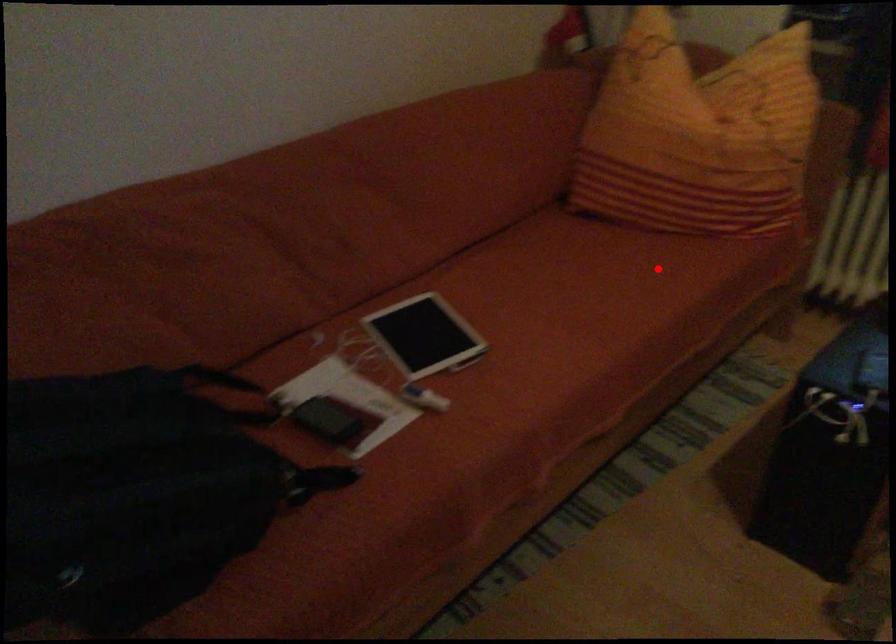
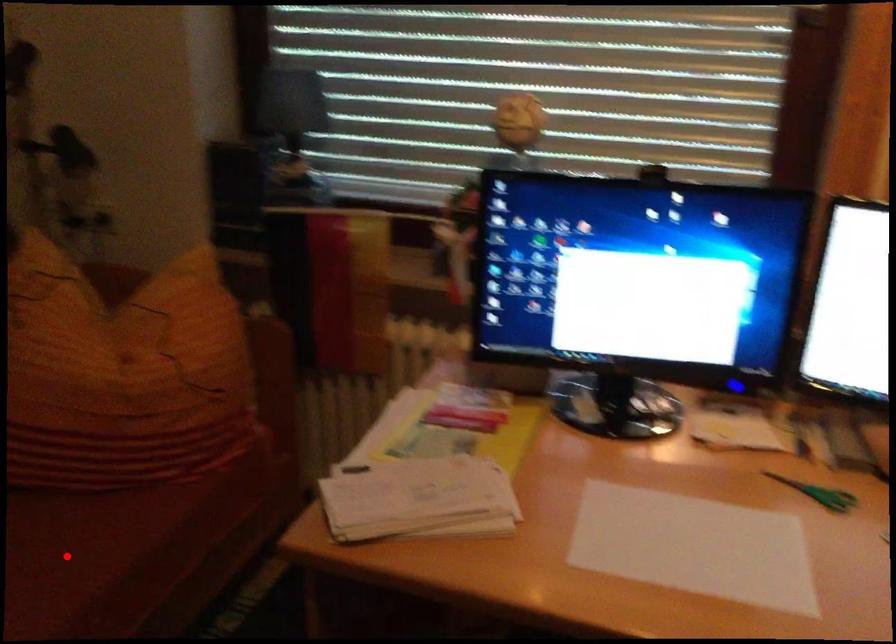
I am providing you with two images of the same scene from different viewpoints. A red point is marked on the first image and another point is marked on the second image. Are the points marked in image1 and image2 representing the same 3D position?

Yes